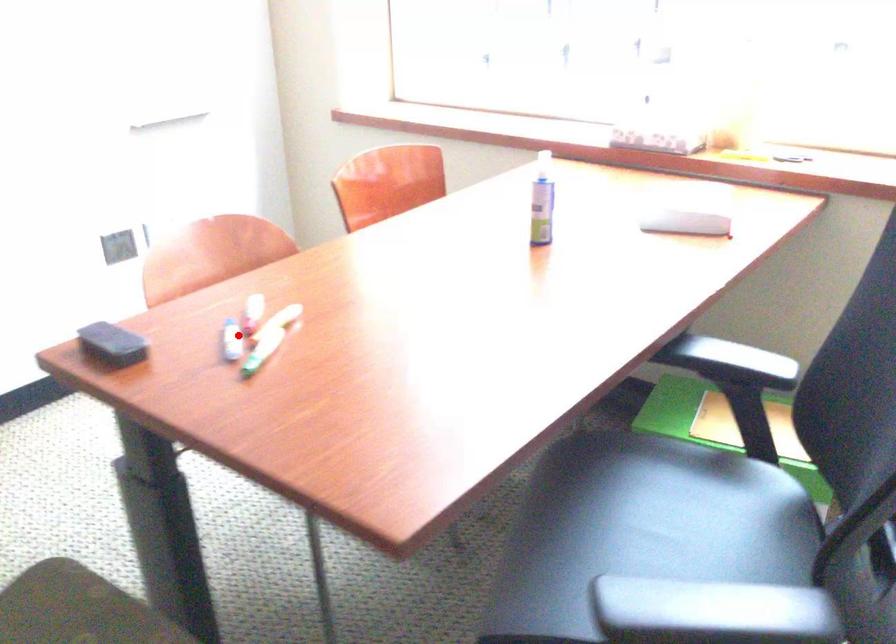
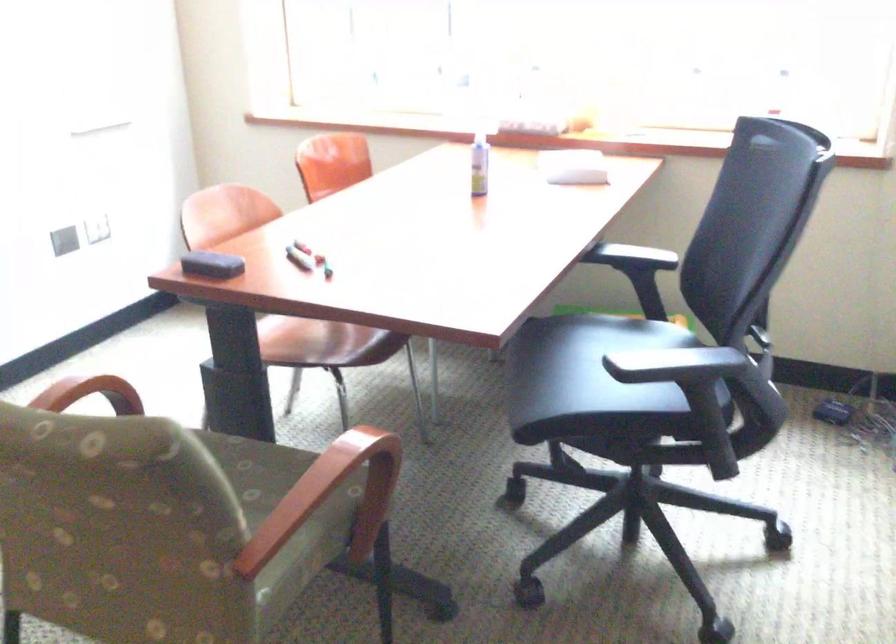
Locate, in the second image, the point that corresponds to the highlighted location in the first image.

(299, 258)